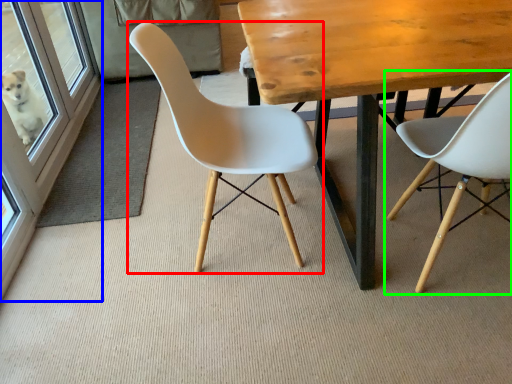
Question: Considering the real-world distances, which object is closest to chair (highlighted by a red box)? screen door (highlighted by a blue box) or chair (highlighted by a green box).

Choices:
 (A) screen door
 (B) chair

Answer: (B)